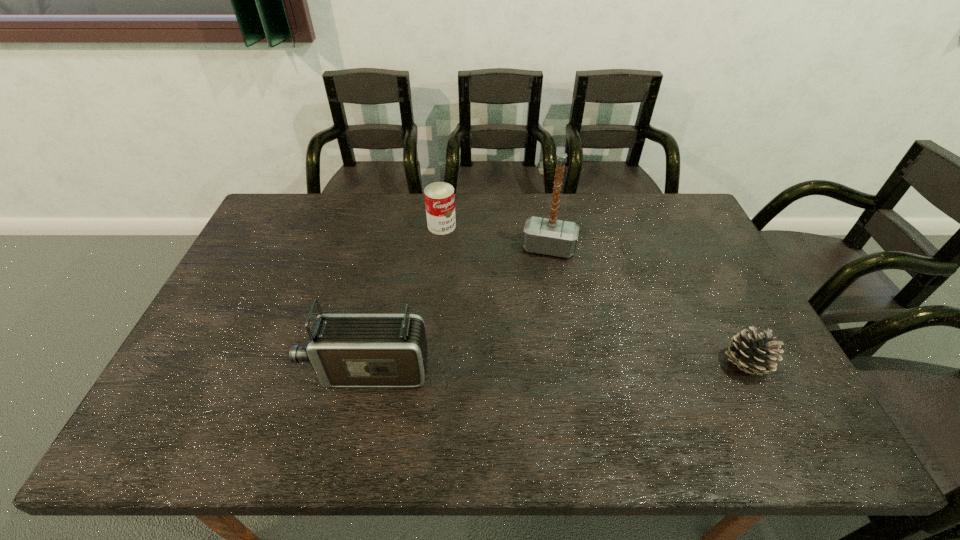
Identify the location of free space located on the back of the pinecone. The width and height of the screenshot is (960, 540). (728, 328).

You are a GUI agent. You are given a task and a screenshot of the screen. Output one action in this format:
    pyautogui.click(x=<x>, y=<y>)
    Task: Click on the free space located on the striking surface of the hammer
    The image size is (960, 540).
    Given the screenshot: What is the action you would take?
    pyautogui.click(x=527, y=347)

The width and height of the screenshot is (960, 540). Identify the location of vacant space located on the striking surface of the hammer. (539, 288).

At what (x,y) coordinates should I click in order to perform the action: click on blank area located 0.380m on the striking surface of the hammer. Please return your answer as a coordinate pair (x, y). Looking at the image, I should click on coord(524,360).

At what (x,y) coordinates should I click in order to perform the action: click on vacant area situated on the front label of the farthest object. Please return your answer as a coordinate pair (x, y). Looking at the image, I should click on (476, 267).

Locate an element on the screen. free space located 0.220m on the front label of the farthest object is located at coordinates (481, 273).

Identify the location of blank space located on the front label of the farthest object. (463, 251).

This screenshot has width=960, height=540. Find the location of `object present at the far edge`. object present at the far edge is located at coordinates (439, 197).

Identify the location of camcorder that is at the near edge. (345, 350).

What are the coordinates of `pinecone present at the near edge` in the screenshot? It's located at (753, 354).